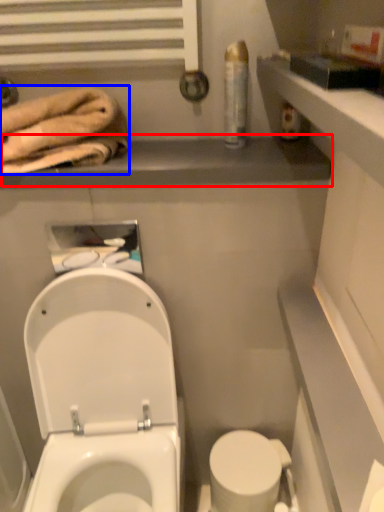
Question: Which object is further to the camera taking this photo, balustrade (highlighted by a red box) or bath towel (highlighted by a blue box)?

Choices:
 (A) balustrade
 (B) bath towel

Answer: (A)